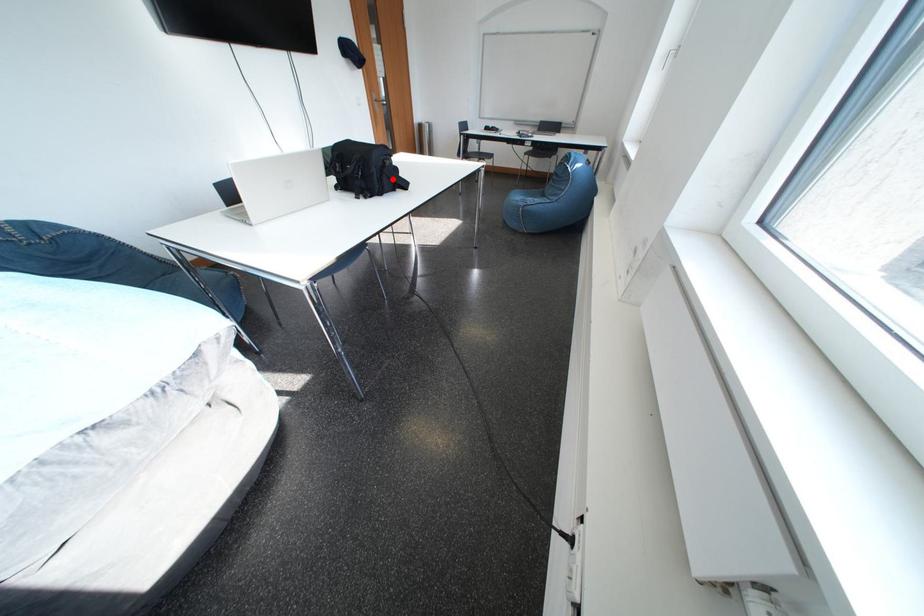
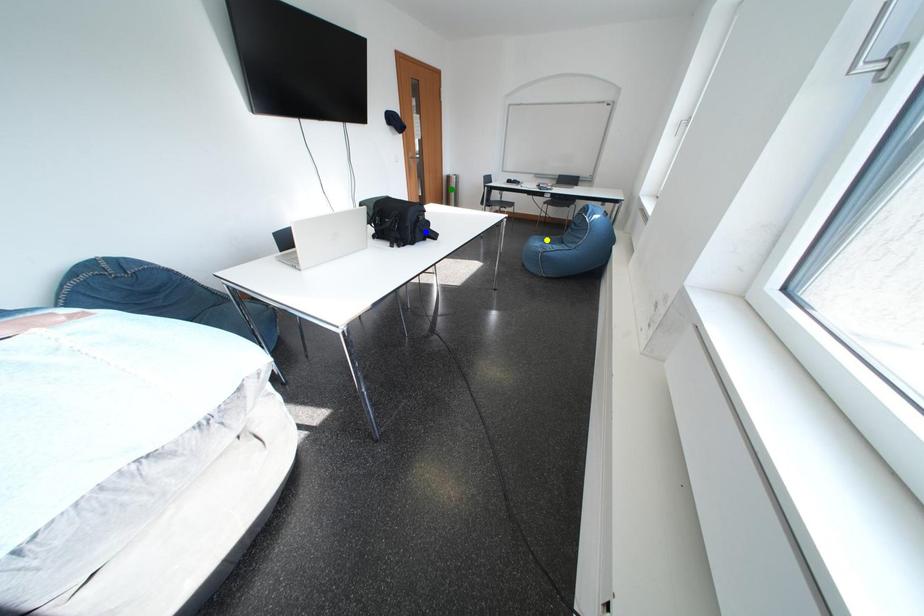
Question: I am providing you with two images of the same scene from different viewpoints. A red point is marked on the first image. You are given multiple points on the second image. In image 2, which mark is for the same physical point as the one in image 1?

Choices:
 (A) blue point
 (B) yellow point
 (C) green point

Answer: (A)